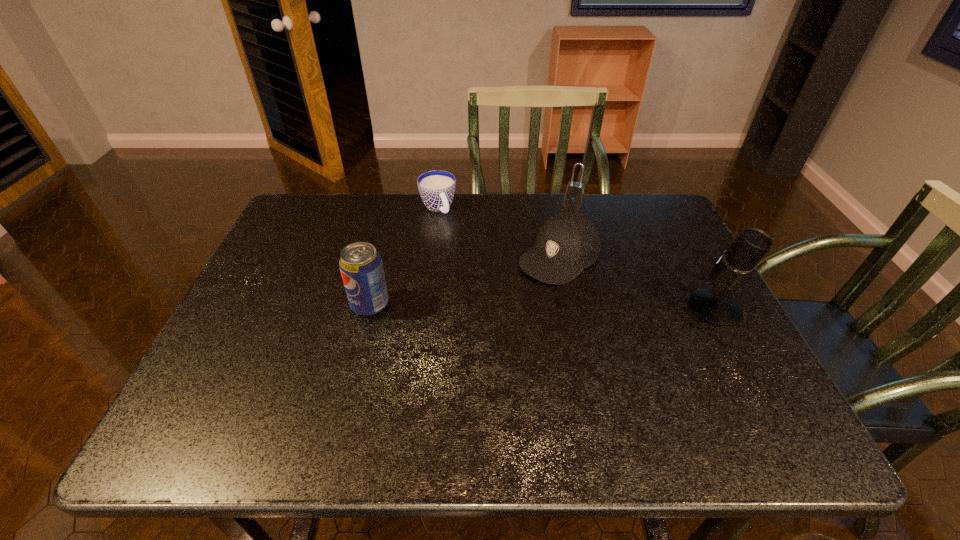
I want to click on the fourth shortest object, so click(361, 267).

You are a GUI agent. You are given a task and a screenshot of the screen. Output one action in this format:
    pyautogui.click(x=<x>, y=<y>)
    Task: Click on the soda
    Image resolution: width=960 pixels, height=540 pixels.
    Given the screenshot: What is the action you would take?
    click(x=361, y=267)

At what (x,y) coordinates should I click in order to perform the action: click on microphone. Please return your answer as a coordinate pair (x, y). The height and width of the screenshot is (540, 960). Looking at the image, I should click on (716, 307).

This screenshot has width=960, height=540. Identify the location of the tallest object. (716, 307).

Locate an element on the screen. This screenshot has width=960, height=540. the third farthest object is located at coordinates (567, 243).

Identify the location of the shortest object. Image resolution: width=960 pixels, height=540 pixels. (437, 187).

You are a GUI agent. You are given a task and a screenshot of the screen. Output one action in this format:
    pyautogui.click(x=<x>, y=<y>)
    Task: Click on the cup
    
    Given the screenshot: What is the action you would take?
    pyautogui.click(x=437, y=187)

What are the coordinates of `padlock` in the screenshot? It's located at (575, 191).

At what (x,y) coordinates should I click in order to perform the action: click on blank space located 0.080m on the front of the soda. Please return your answer as a coordinate pair (x, y). Looking at the image, I should click on (360, 346).

Find the location of a particular element. The width and height of the screenshot is (960, 540). vacant space located 0.330m on the left of the microphone is located at coordinates (554, 308).